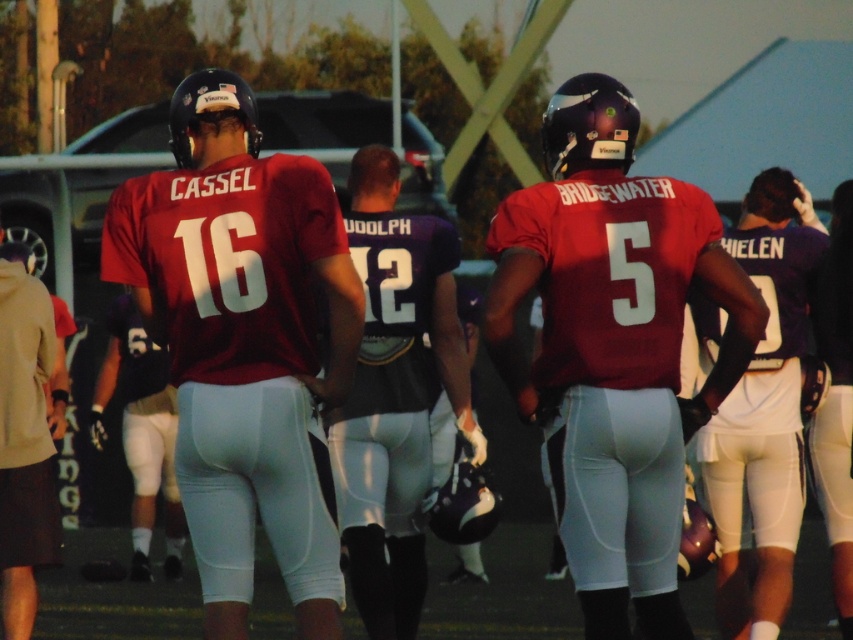
Is matte maroon jersey at center taller than matte red jersey at center?

No.

Who is more distant from viewer, [252,228] or [677,516]?

Point [677,516]

Locate an element on the screen. matte maroon jersey at center is located at coordinates (242, 340).